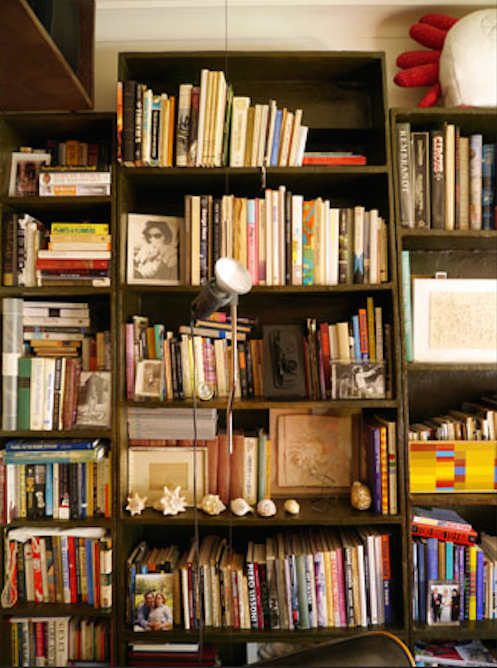
Find the location of a particular element. The height and width of the screenshot is (668, 497). pictures is located at coordinates (438, 611), (153, 604), (149, 383), (367, 381), (152, 248).